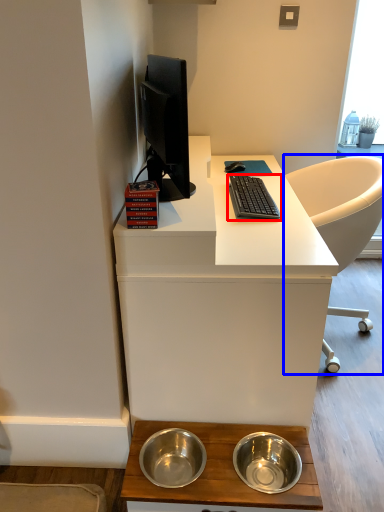
Question: Among these objects, which one is farthest to the camera, computer keyboard (highlighted by a red box) or chair (highlighted by a blue box)?

Choices:
 (A) computer keyboard
 (B) chair

Answer: (B)